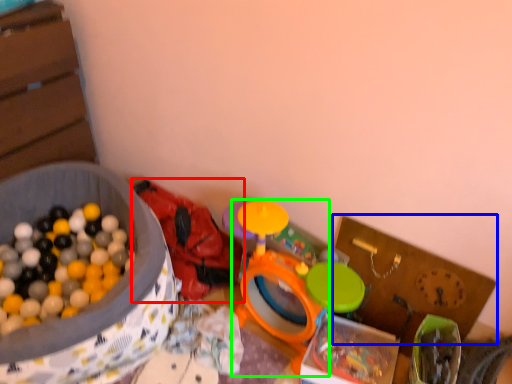
Question: Which object is the closest to the toy (highlighted by a red box)? Choose among these: cardboard box (highlighted by a blue box) or toy (highlighted by a green box).

Choices:
 (A) cardboard box
 (B) toy

Answer: (B)